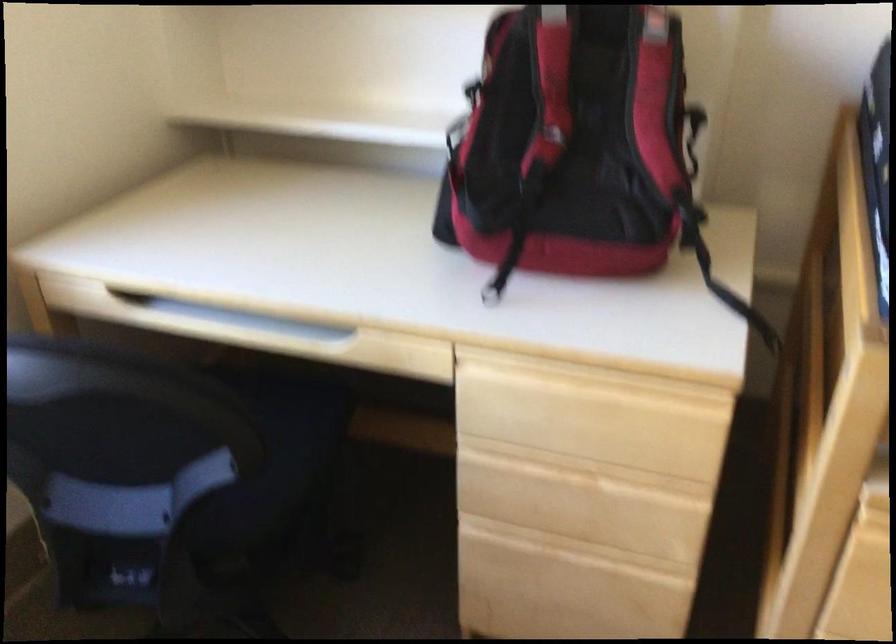
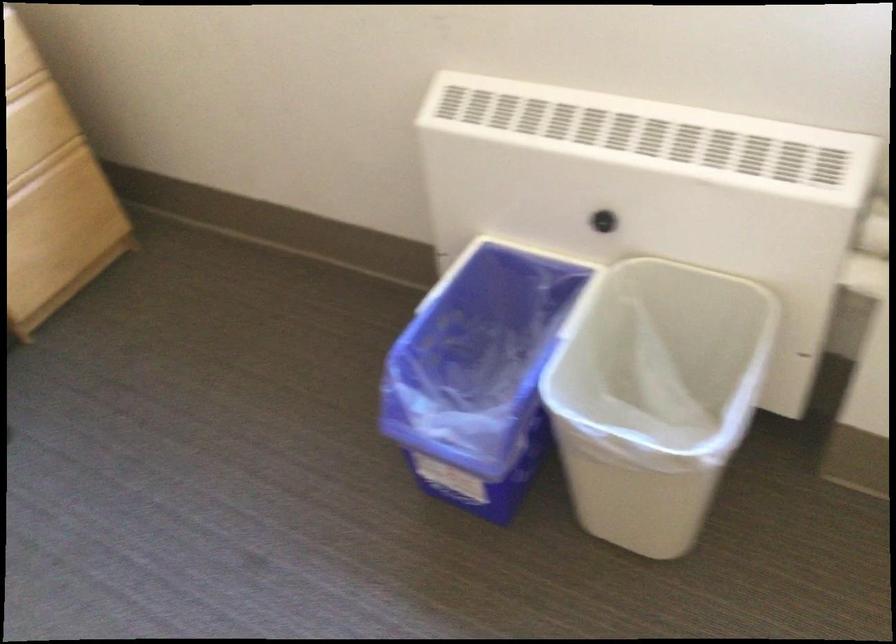
The images are taken continuously from a first-person perspective. In which direction is your viewpoint rotating?

The rotation direction of the camera is left-down.